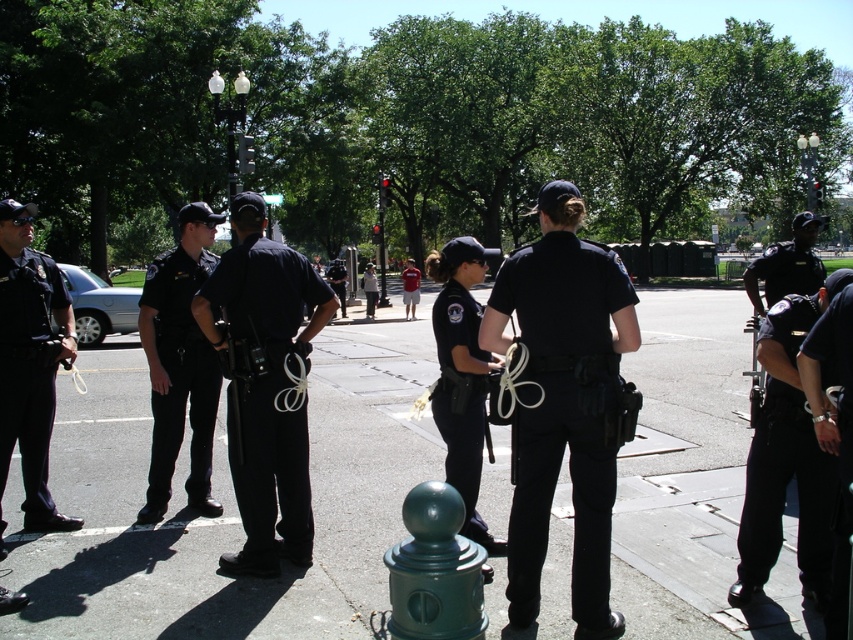
Question: Which point is closer to the camera taking this photo?

Choices:
 (A) (0, 385)
 (B) (437, 486)
 (C) (544, 248)
 (D) (749, 573)

Answer: (B)

Question: Does black uniform at center appear on the right side of green matte hydrant at lower center?

Choices:
 (A) no
 (B) yes

Answer: (A)

Question: Which point is closer to the camera?

Choices:
 (A) matte black uniform at center
 (B) black matte uniform at center

Answer: (B)

Question: Which point is farther to the camera?

Choices:
 (A) black matte uniform at right
 (B) black matte uniform at center
 (C) matte black uniform at left

Answer: (C)

Question: Is matte black uniform at center below green matte hydrant at lower center?

Choices:
 (A) no
 (B) yes

Answer: (A)

Question: Is black matte uniform at center positioned behind black matte uniform at right?

Choices:
 (A) no
 (B) yes

Answer: (B)